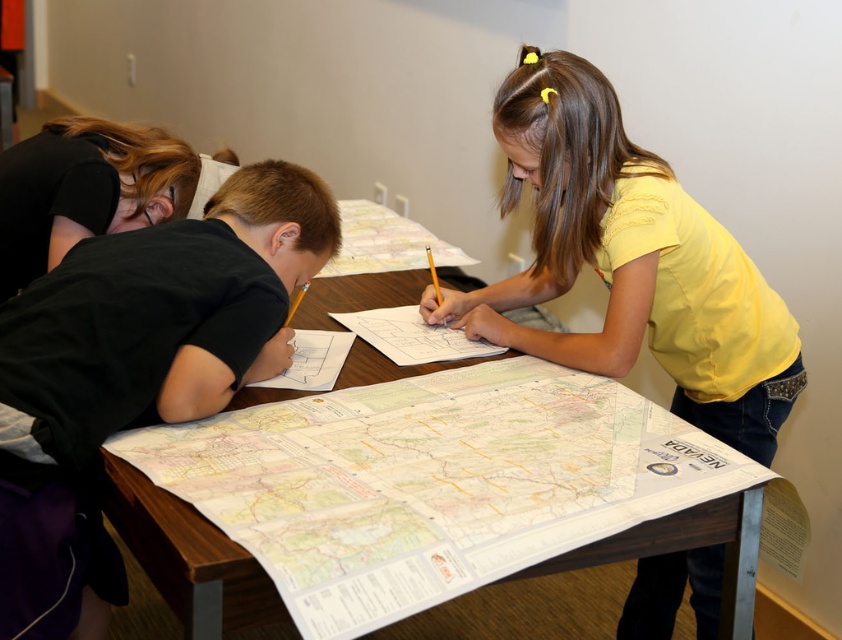
Between black matte shirt at left and wooden table at center, which one has more height?

With more height is black matte shirt at left.

Can you confirm if black matte shirt at left is positioned to the left of wooden table at center?

Correct, you'll find black matte shirt at left to the left of wooden table at center.

Image resolution: width=842 pixels, height=640 pixels. What are the coordinates of `black matte shirt at left` in the screenshot? It's located at (136, 372).

The image size is (842, 640). I want to click on black matte shirt at left, so click(x=136, y=372).

Find the location of `yellow cotton shirt at center`. yellow cotton shirt at center is located at coordinates (630, 260).

Does point (568, 145) lie in front of point (265, 584)?

That is False.

Is point (712, 330) positioned before point (693, 518)?

No, (712, 330) is behind (693, 518).

The width and height of the screenshot is (842, 640). I want to click on yellow cotton shirt at center, so [630, 260].

Does black matte shirt at left have a lesser height compared to yellow cotton shirt at center?

No.

Can you confirm if black matte shirt at left is positioned to the left of yellow cotton shirt at center?

Indeed, black matte shirt at left is positioned on the left side of yellow cotton shirt at center.

Between point (144, 376) and point (665, 186), which one is positioned behind?

The point (665, 186) is behind.

This screenshot has height=640, width=842. I want to click on black matte shirt at left, so click(136, 372).